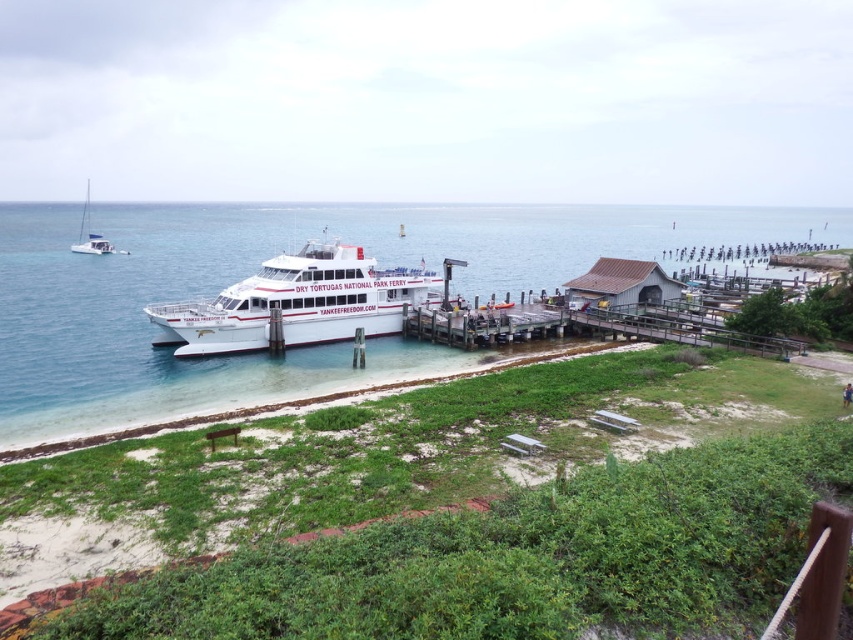
Question: Which object is farther from the camera taking this photo?

Choices:
 (A) white glossy sailboat at upper left
 (B) white matte ferry at center
 (C) clear blue water at center

Answer: (A)

Question: Does white matte ferry at center lie in front of white glossy sailboat at upper left?

Choices:
 (A) yes
 (B) no

Answer: (A)

Question: Which point is closer to the camera?

Choices:
 (A) (355, 237)
 (B) (73, 244)
 (C) (341, 248)

Answer: (C)

Question: Can you confirm if white matte ferry at center is positioned to the right of white glossy sailboat at upper left?

Choices:
 (A) no
 (B) yes

Answer: (B)

Question: Is clear blue water at center thinner than white glossy sailboat at upper left?

Choices:
 (A) yes
 (B) no

Answer: (B)

Question: Based on their relative distances, which object is farther from the white glossy sailboat at upper left?

Choices:
 (A) white matte ferry at center
 (B) clear blue water at center

Answer: (B)